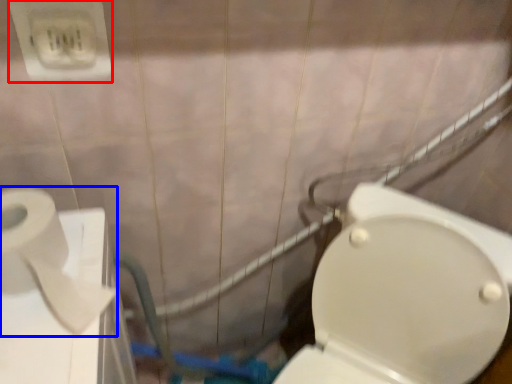
Question: Among these objects, which one is nearest to the camera, electric outlet (highlighted by a red box) or toilet paper (highlighted by a blue box)?

Choices:
 (A) electric outlet
 (B) toilet paper

Answer: (B)